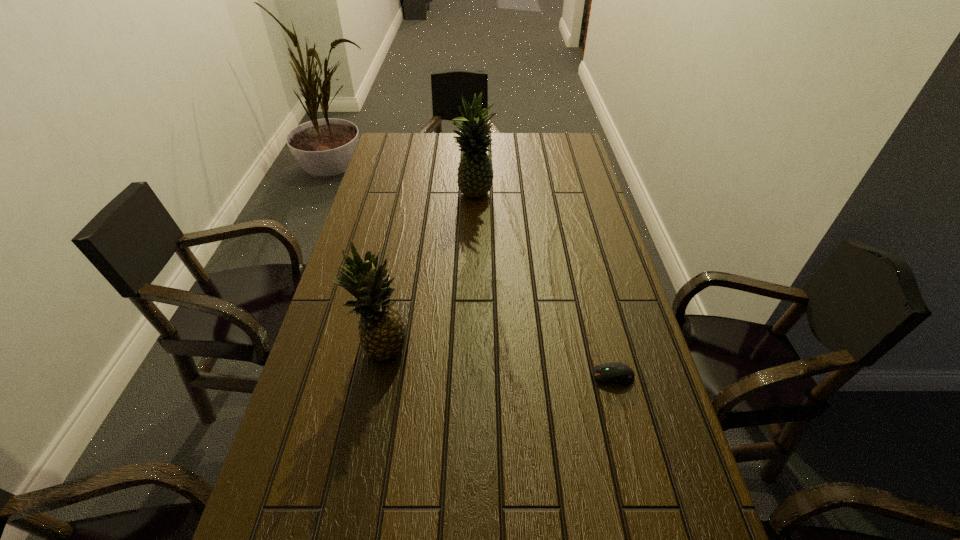
I want to click on vacant region located 0.060m on the button of the rightmost object, so click(567, 376).

Find the location of a particular element. This screenshot has height=540, width=960. object that is positioned at the left edge is located at coordinates (382, 332).

Find the location of a particular element. object positioned at the right edge is located at coordinates (618, 373).

Where is `vacant space at the far edge`? This screenshot has height=540, width=960. vacant space at the far edge is located at coordinates (513, 148).

The width and height of the screenshot is (960, 540). In the image, there is a desktop. Find the location of `blank space at the left edge`. blank space at the left edge is located at coordinates (345, 365).

Find the location of a particular element. The image size is (960, 540). blank area at the right edge is located at coordinates (550, 180).

Where is `vacant space that's between the second object from left to right and the leftmost object`? Image resolution: width=960 pixels, height=540 pixels. vacant space that's between the second object from left to right and the leftmost object is located at coordinates (429, 273).

Find the location of a particular element. This screenshot has height=540, width=960. vacant point located between the left pineapple and the second object from left to right is located at coordinates (429, 273).

At what (x,y) coordinates should I click in order to perform the action: click on free space that is in between the rightmost object and the leftmost object. Please return your answer as a coordinate pair (x, y). The height and width of the screenshot is (540, 960). Looking at the image, I should click on (498, 363).

This screenshot has width=960, height=540. Find the location of `vacant area that lies between the farther pineapple and the nearer pineapple`. vacant area that lies between the farther pineapple and the nearer pineapple is located at coordinates (429, 273).